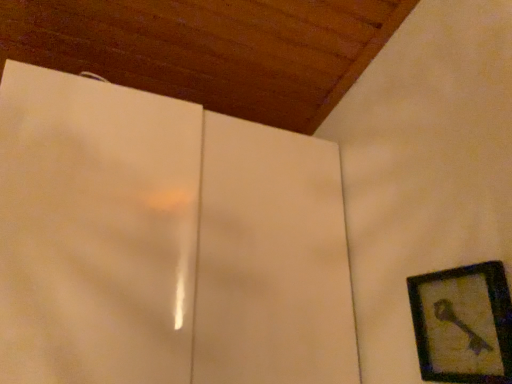
Measure the distance between wooden picture frame at lower right and camera.

32.97 inches.

In order to face wooden picture frame at lower right, should I rotate leftwards or rightwards?

Turn right by 25.220 degrees to look at wooden picture frame at lower right.

Describe the element at coordinates (463, 324) in the screenshot. I see `wooden picture frame at lower right` at that location.

Identify the location of wooden picture frame at lower right. (463, 324).

At what (x,y) coordinates should I click in order to perform the action: click on wooden picture frame at lower right. Please return your answer as a coordinate pair (x, y). Looking at the image, I should click on (463, 324).